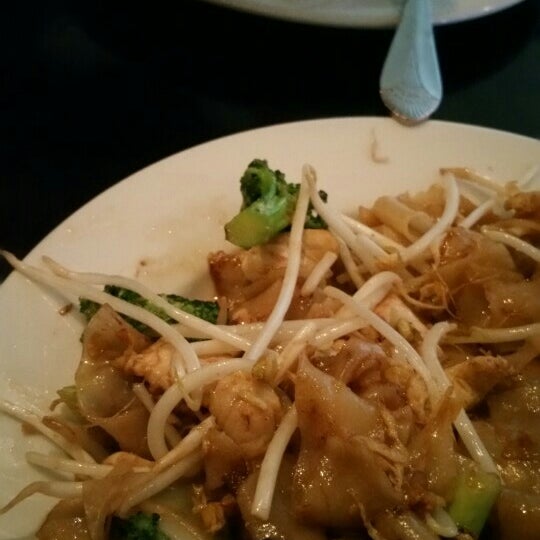
Identify the location of bowl edgde. This screenshot has width=540, height=540. (361, 162).